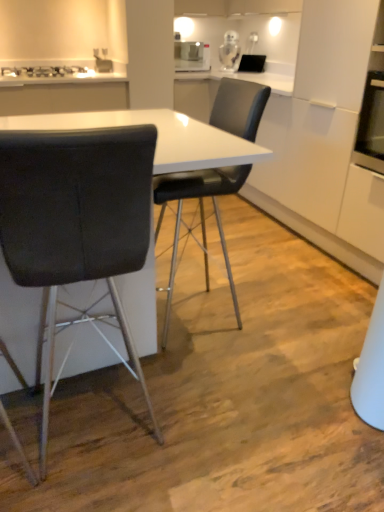
The width and height of the screenshot is (384, 512). In order to click on free location to the right of black leather chair at left, which is the second chair in right-to-left order in this screenshot , I will do `click(222, 437)`.